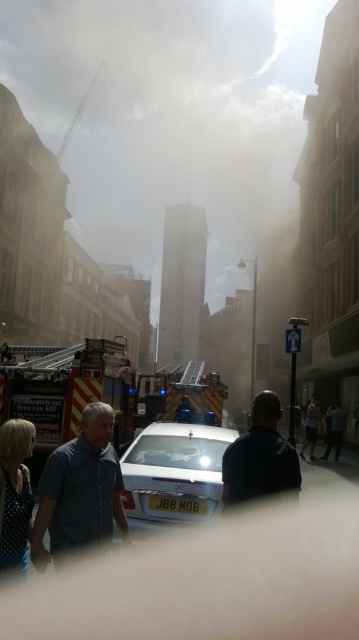
Question: Which of the following is the farthest from the observer?

Choices:
 (A) dark blue shirt at lower right
 (B) polka dot blouse at lower left
 (C) blue denim shirt at center
 (D) dark blue shirt at center

Answer: (A)

Question: Observing the image, what is the correct spatial positioning of dark blue shirt at center in reference to dark blue jeans at center?

Choices:
 (A) right
 (B) left

Answer: (B)

Question: Estimate the real-world distances between objects in this image. Which object is closer to the blue denim shirt at center?

Choices:
 (A) dark blue shirt at center
 (B) yellow reflective fire truck at left
 (C) dark blue shirt at lower right

Answer: (A)

Question: Which is farther from the blue denim shirt at center?

Choices:
 (A) white glossy car at center
 (B) dark blue jeans at center
 (C) dark blue shirt at lower right

Answer: (B)

Question: Is dark blue shirt at lower right thinner than dark blue jeans at center?

Choices:
 (A) no
 (B) yes

Answer: (A)

Question: Is polka dot blouse at lower left thinner than dark blue jeans at center?

Choices:
 (A) no
 (B) yes

Answer: (B)